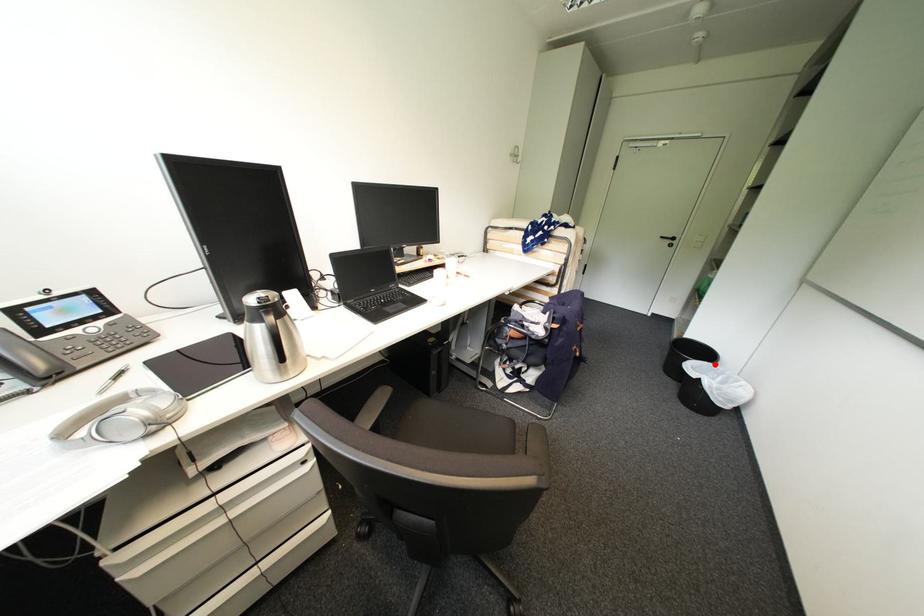
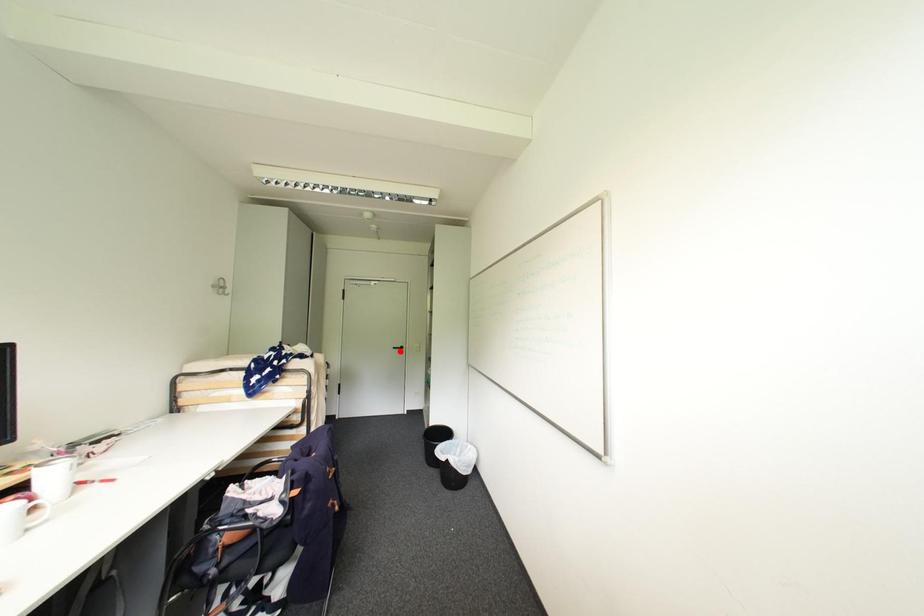
I am providing you with two images of the same scene from different viewpoints. A red point is marked on the first image and another point is marked on the second image. Is the marked point in image1 the same physical position as the marked point in image2?

No